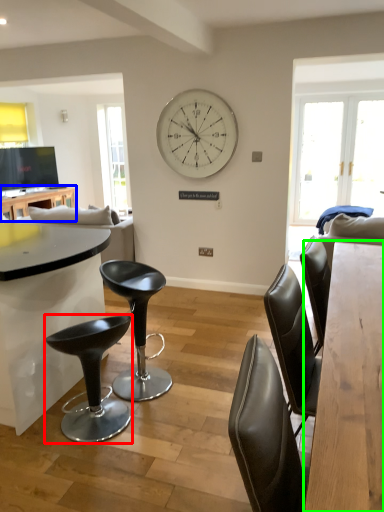
Question: Based on their relative distances, which object is nearer to bar stool (highlighted by a red box)? Choose from table (highlighted by a blue box) and table (highlighted by a green box).

Choices:
 (A) table
 (B) table

Answer: (B)